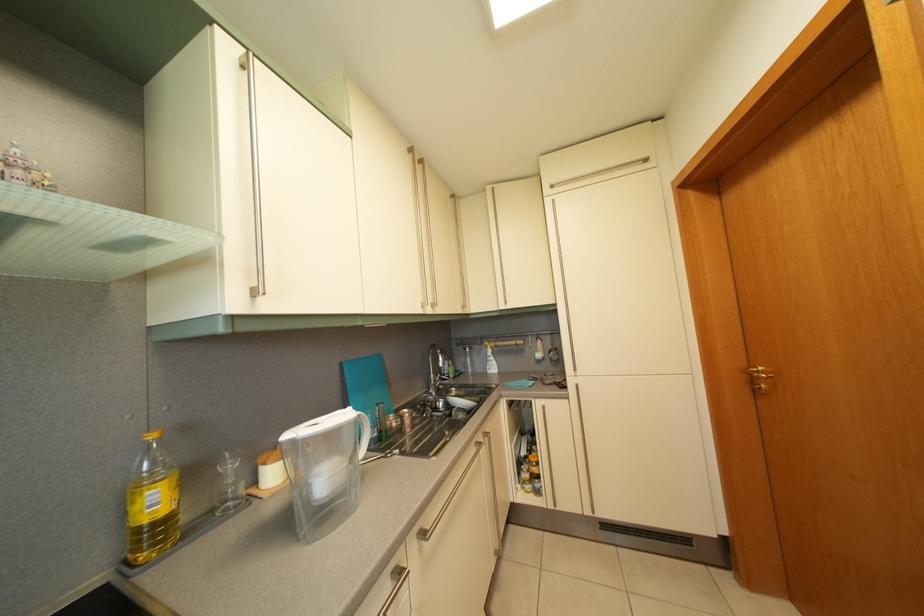
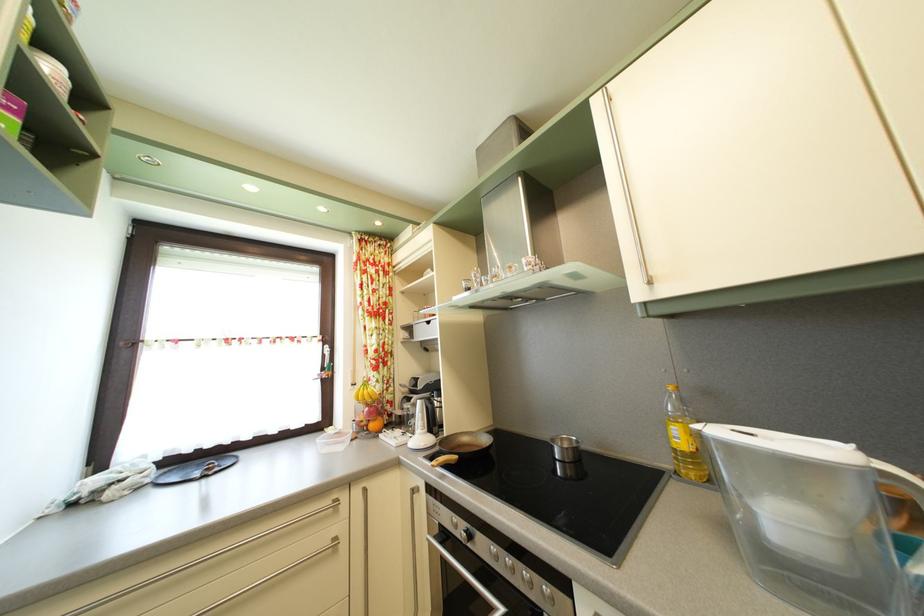
The point at (334,485) is marked in the first image. Where is the corresponding point in the second image?

(793, 528)